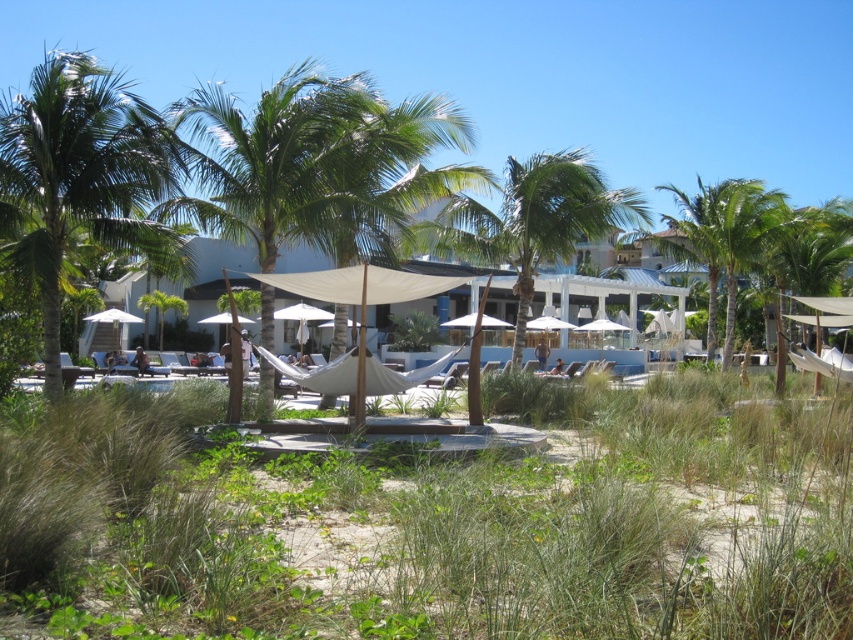
Between green leafy palm tree at left and green leafy palm tree at center, which one appears on the right side from the viewer's perspective?

green leafy palm tree at center

You are a GUI agent. You are given a task and a screenshot of the screen. Output one action in this format:
    pyautogui.click(x=<x>, y=<y>)
    Task: Click on the green leafy palm tree at left
    Image resolution: width=853 pixels, height=640 pixels.
    Given the screenshot: What is the action you would take?
    pyautogui.click(x=78, y=179)

What are the coordinates of `green leafy palm tree at left` in the screenshot? It's located at (78, 179).

Is the position of green leafy palm tree at center more distant than that of green leafy palm tree at center-right?

No, green leafy palm tree at center is closer to the viewer.

Describe the element at coordinates (532, 221) in the screenshot. I see `green leafy palm tree at center` at that location.

The image size is (853, 640). I want to click on green leafy palm tree at center, so click(x=532, y=221).

Can you confirm if green leafy palm tree at left is positioned to the right of green leafy palm tree at center-right?

Incorrect, green leafy palm tree at left is not on the right side of green leafy palm tree at center-right.

Who is lower down, green leafy palm tree at left or green leafy palm tree at center-right?

green leafy palm tree at center-right is below.

Locate an element on the screen. The image size is (853, 640). green leafy palm tree at left is located at coordinates (78, 179).

Where is `green leafy palm tree at left`? green leafy palm tree at left is located at coordinates pyautogui.click(x=78, y=179).